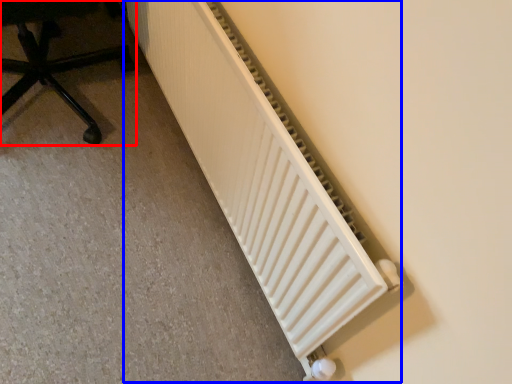
Question: Which object appears closest to the camera in this image, furniture (highlighted by a red box) or radiator (highlighted by a blue box)?

Choices:
 (A) furniture
 (B) radiator

Answer: (B)